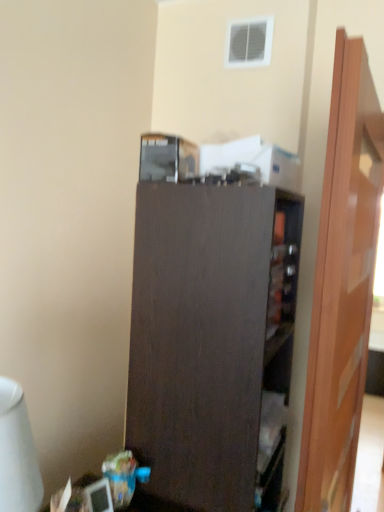
Question: From the image's perspective, is dark wood cupboard at center under wooden door at right?

Choices:
 (A) no
 (B) yes

Answer: (B)

Question: Does dark wood cupboard at center have a greater height compared to wooden door at right?

Choices:
 (A) no
 (B) yes

Answer: (A)

Question: Is dark wood cupboard at center far from wooden door at right?

Choices:
 (A) yes
 (B) no

Answer: (B)

Question: Is the surface of dark wood cupboard at center in direct contact with wooden door at right?

Choices:
 (A) no
 (B) yes

Answer: (A)

Question: Does dark wood cupboard at center have a lesser width compared to wooden door at right?

Choices:
 (A) yes
 (B) no

Answer: (B)

Question: Is white glossy table lamp at lower left spatially inside wooden door at right, or outside of it?

Choices:
 (A) outside
 (B) inside

Answer: (A)

Question: In the image, is white glossy table lamp at lower left positioned in front of or behind wooden door at right?

Choices:
 (A) front
 (B) behind

Answer: (A)

Question: Considering the positions of white glossy table lamp at lower left and wooden door at right in the image, is white glossy table lamp at lower left taller or shorter than wooden door at right?

Choices:
 (A) tall
 (B) short

Answer: (B)

Question: Considering the positions of white glossy table lamp at lower left and wooden door at right in the image, is white glossy table lamp at lower left bigger or smaller than wooden door at right?

Choices:
 (A) big
 (B) small

Answer: (B)

Question: Is dark wood cupboard at center wider or thinner than wooden door at right?

Choices:
 (A) wide
 (B) thin

Answer: (A)

Question: Based on their sizes in the image, would you say dark wood cupboard at center is bigger or smaller than wooden door at right?

Choices:
 (A) big
 (B) small

Answer: (A)

Question: Which is correct: dark wood cupboard at center is inside wooden door at right, or outside of it?

Choices:
 (A) outside
 (B) inside

Answer: (A)

Question: From the image's perspective, is dark wood cupboard at center above or below wooden door at right?

Choices:
 (A) below
 (B) above

Answer: (A)

Question: In terms of height, does white glossy table lamp at lower left look taller or shorter compared to dark wood cupboard at center?

Choices:
 (A) tall
 (B) short

Answer: (B)

Question: From the image's perspective, relative to dark wood cupboard at center, is white glossy table lamp at lower left above or below?

Choices:
 (A) above
 (B) below

Answer: (A)